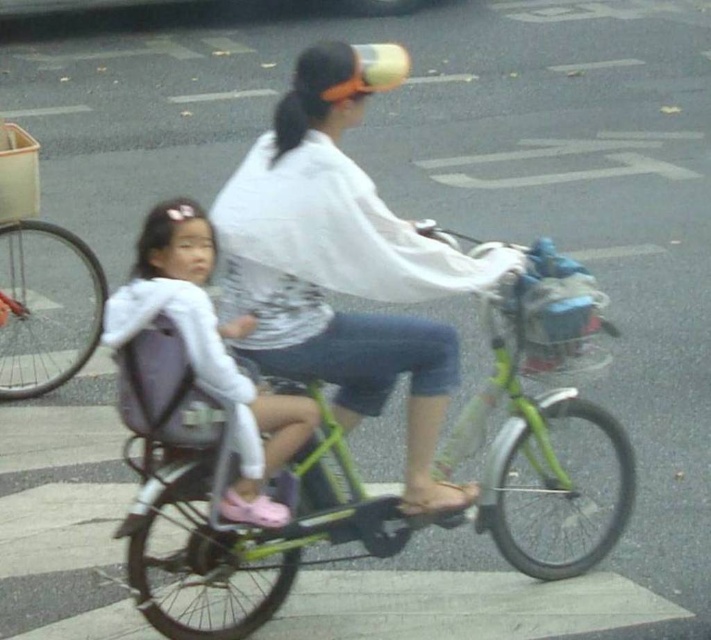
You are a delivery person who needs to carry a box that is 1.2 meters wide. You see the green matte bicycle at center and the white matte shirt at center. Which object can accommodate the box based on their widths?

The green matte bicycle at center has a larger width than the white matte shirt at center, so the box can be placed on the green matte bicycle at center.

You are a pedestrian standing on the sidewalk next to the green matte bicycle at center and the white matte jacket at center. Which object is taller?

The green matte bicycle at center is taller than the white matte jacket at center according to the description.